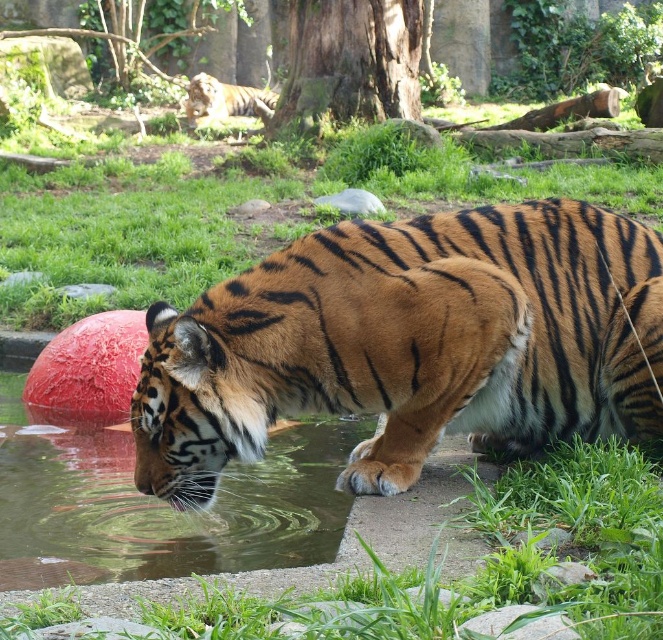
You are a zookeeper planning to refill the water source for the orange striped tiger at upper center. Considering the size of the clear water at lower left, how much water do you estimate you need to bring to maintain the current water level?

The clear water at lower left has a larger size compared to orange striped tiger at upper center, so you need to bring a significant amount of water to maintain the current level, as the existing water source is quite large.

You are a zookeeper who needs to ensure the safety of visitors by maintaining a minimum safe distance of 40 feet between the two tigers. Based on the scene, is the current distance between the orange fur tiger at center and the orange striped tiger at upper center sufficient to meet this requirement?

The distance between the orange fur tiger at center and the orange striped tiger at upper center is 40.86 feet, which exceeds the required 40 feet minimum safe distance. Therefore, the current spacing meets the safety requirement.

You are a zookeeper who needs to ensure that both tigers have enough space. The orange fur tiger at center is currently in the enclosure. Can you determine if the orange striped tiger at upper center can fit in the same enclosure without overcrowding?

The orange fur tiger at center is smaller than the orange striped tiger at upper center. Therefore, the orange striped tiger at upper center requires more space, so it may not fit comfortably in the same enclosure without overcrowding.